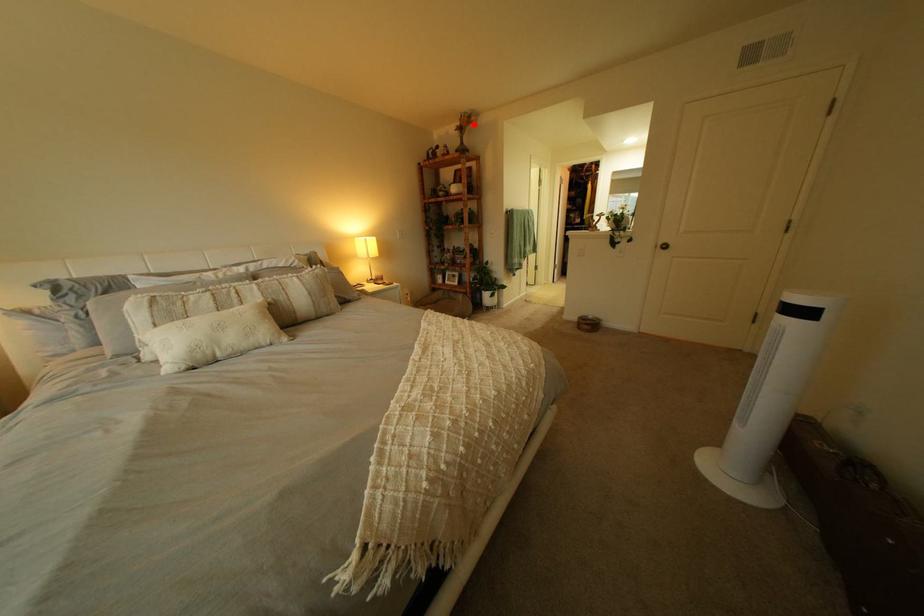
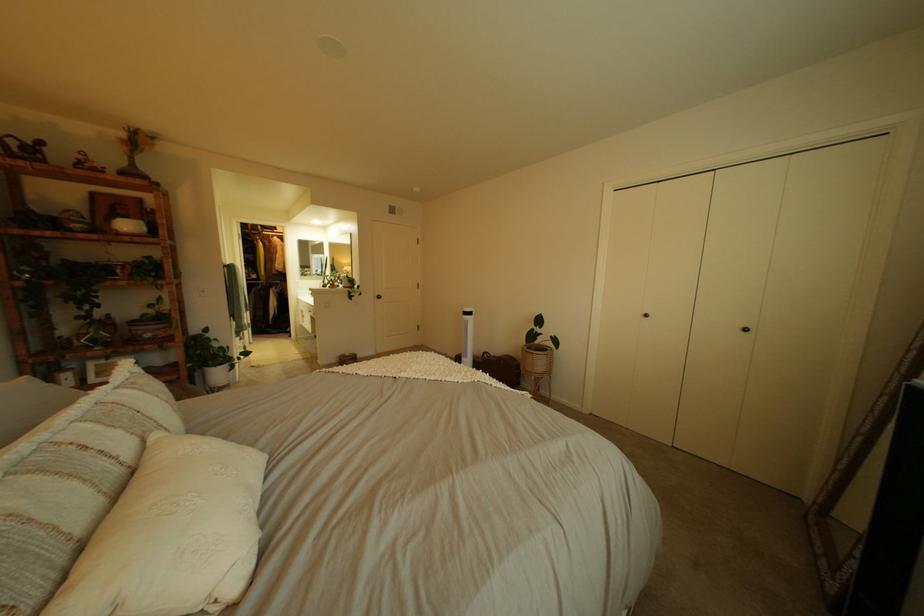
Locate, in the second image, the point that corresponds to the highlighted location in the first image.

(139, 137)